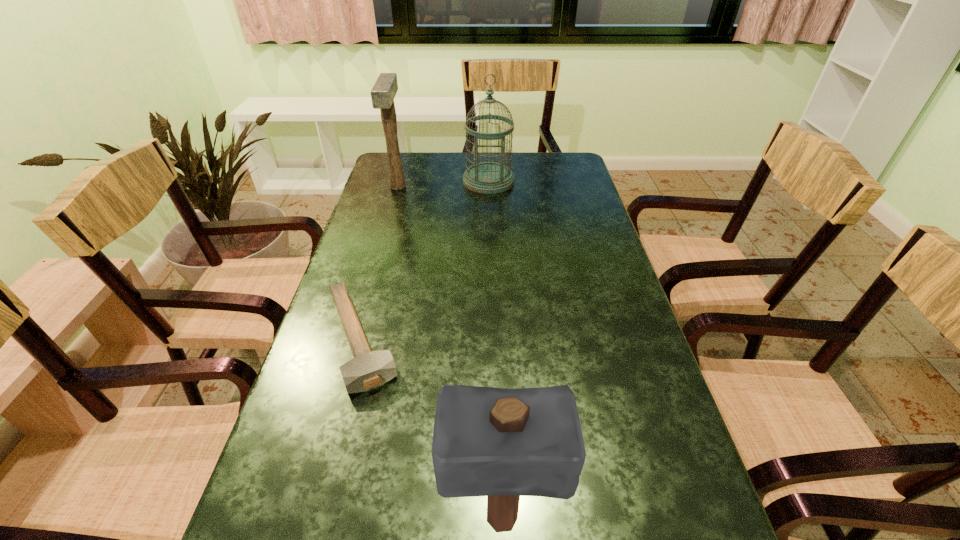
Find the location of a particular element. The image size is (960, 540). the second closest mallet relative to the shortest mallet is located at coordinates (384, 90).

Point out which mallet is positioned as the nearest to the rightmost mallet. Please provide its 2D coordinates. Your answer should be formatted as a tuple, i.e. [(x, y)], where the tuple contains the x and y coordinates of a point satisfying the conditions above.

[(368, 369)]

Identify the location of free space that satisfies the following two spatial constraints: 1. on the front side of the farthest mallet; 2. on the right side of the second nearest object. The image size is (960, 540). (355, 339).